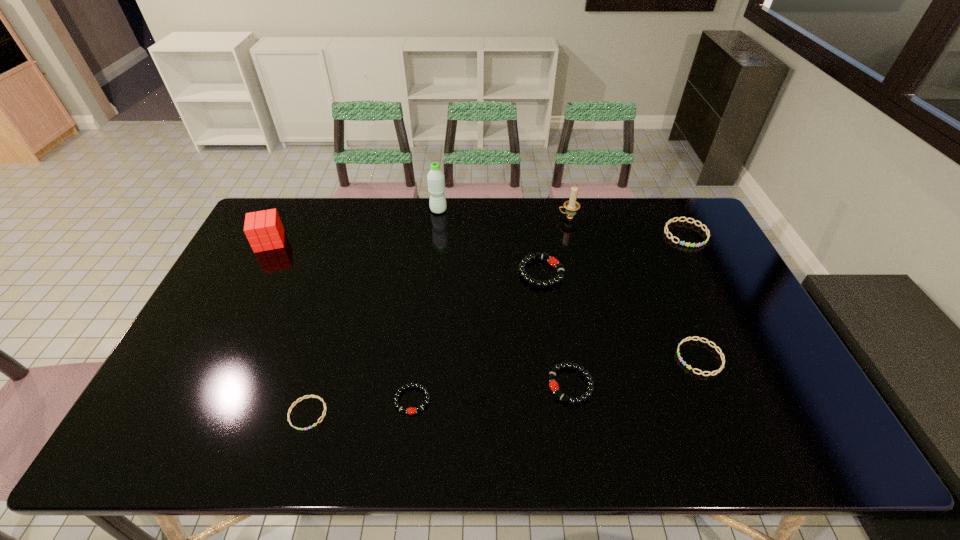
Locate an element on the screen. Image resolution: width=960 pixels, height=540 pixels. vacant area at the near left corner is located at coordinates (166, 423).

The width and height of the screenshot is (960, 540). I want to click on free space at the far right corner of the desktop, so click(686, 232).

You are a GUI agent. You are given a task and a screenshot of the screen. Output one action in this format:
    pyautogui.click(x=<x>, y=<y>)
    Task: Click on the free space that is in between the shortest object and the biggest blue bracelet
    Image resolution: width=960 pixels, height=540 pixels.
    Given the screenshot: What is the action you would take?
    [x=497, y=323]

Where is `vacant space in between the farthest blue bracelet and the farthest black bracelet`? vacant space in between the farthest blue bracelet and the farthest black bracelet is located at coordinates coord(613,253).

Find the location of a particular element. vacant point located between the biggest blue bracelet and the second biggest black bracelet is located at coordinates (628, 309).

I want to click on free space between the biggest black bracelet and the biggest blue bracelet, so click(613, 253).

Locate an element on the screen. The image size is (960, 540). free space between the seventh shortest object and the farthest bracelet is located at coordinates (478, 238).

Image resolution: width=960 pixels, height=540 pixels. What are the coordinates of `free space between the second biggest black bracelet and the biggest blue bracelet` in the screenshot? It's located at (628, 309).

In order to click on vacant area that lies between the green water bottle and the second biggest blue bracelet in this screenshot , I will do `click(569, 284)`.

At what (x,y) coordinates should I click in order to perform the action: click on free space between the shortest bracelet and the farthest black bracelet. Please return your answer as a coordinate pair (x, y). Image resolution: width=960 pixels, height=540 pixels. Looking at the image, I should click on (424, 343).